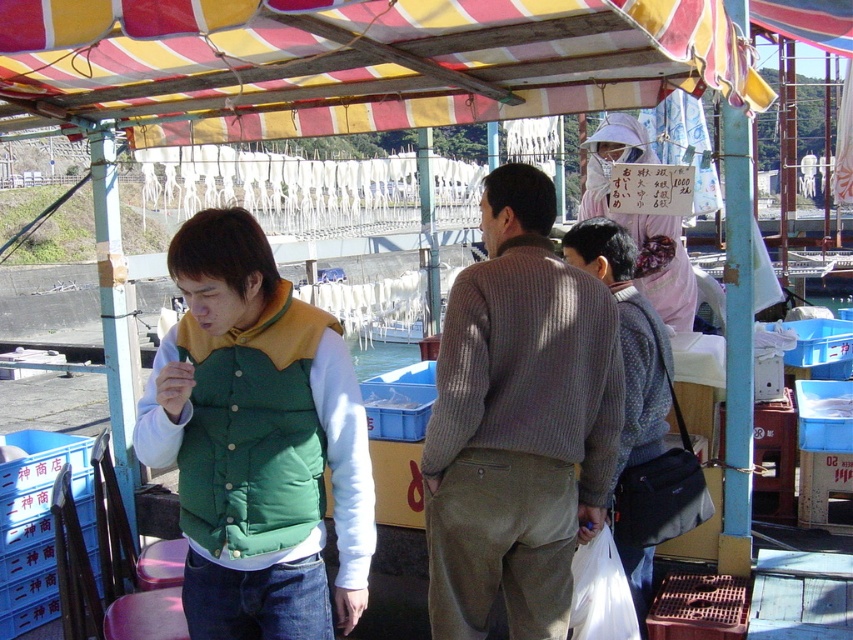
Question: Which of the following is the closest to the observer?

Choices:
 (A) knitted sweater at center
 (B) green puffer vest at center
 (C) yellow striped canopy at upper center

Answer: (C)

Question: Does green puffer vest at center appear over green puffy vest at center?

Choices:
 (A) no
 (B) yes

Answer: (A)

Question: Which of the following is the closest to the observer?

Choices:
 (A) green puffy vest at center
 (B) knitted sweater at center

Answer: (A)

Question: Which point is farther from the camera taking this photo?

Choices:
 (A) (502, 468)
 (B) (302, 328)

Answer: (A)

Question: Can you confirm if knitted sweater at center is smaller than polka dot sweater at center?

Choices:
 (A) yes
 (B) no

Answer: (A)

Question: Is knitted sweater at center positioned in front of polka dot sweater at center?

Choices:
 (A) yes
 (B) no

Answer: (A)